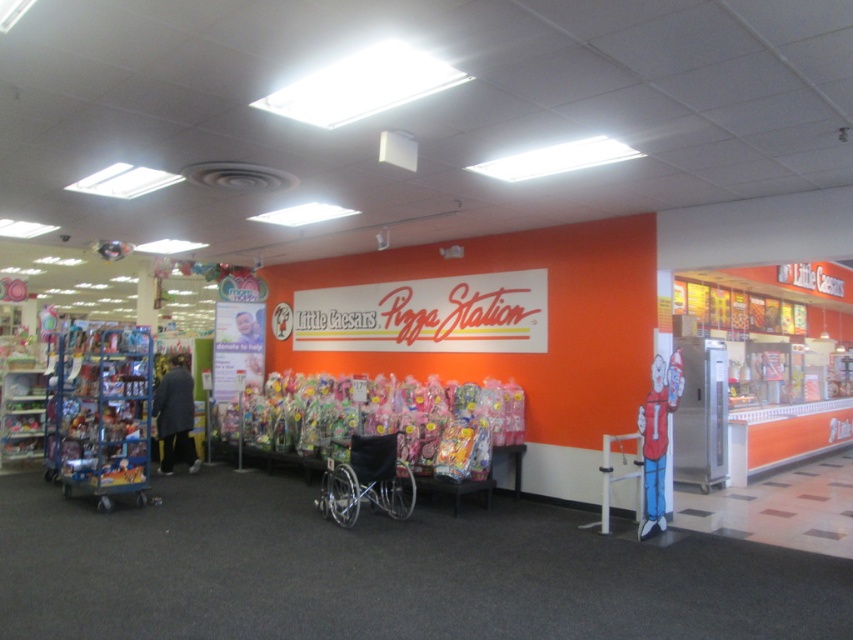
Question: Which of the following is the farthest from the observer?

Choices:
 (A) (361, 448)
 (B) (158, 429)

Answer: (B)

Question: Can you confirm if black plastic wheelchair at center is positioned to the right of dark gray coat at left?

Choices:
 (A) yes
 (B) no

Answer: (A)

Question: Is translucent plastic toys at center closer to camera compared to dark gray coat at left?

Choices:
 (A) yes
 (B) no

Answer: (A)

Question: Does translucent plastic toys at center appear over black plastic wheelchair at center?

Choices:
 (A) yes
 (B) no

Answer: (A)

Question: Which object is farther from the camera taking this photo?

Choices:
 (A) dark gray coat at left
 (B) translucent plastic toys at center
 (C) black plastic wheelchair at center

Answer: (A)

Question: Which point is farther from the camera taking this photo?

Choices:
 (A) (412, 419)
 (B) (393, 515)

Answer: (A)